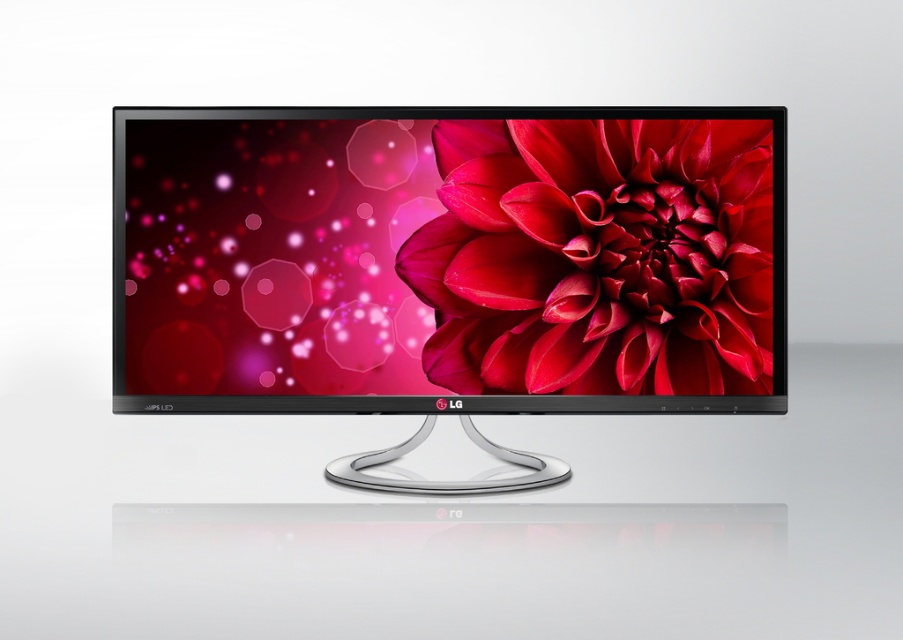
Describe the element at coordinates (448, 266) in the screenshot. The height and width of the screenshot is (640, 903). I see `satin black monitor at center` at that location.

This screenshot has width=903, height=640. In order to click on satin black monitor at center in this screenshot , I will do `click(448, 266)`.

Locate an element on the screen. satin black monitor at center is located at coordinates (448, 266).